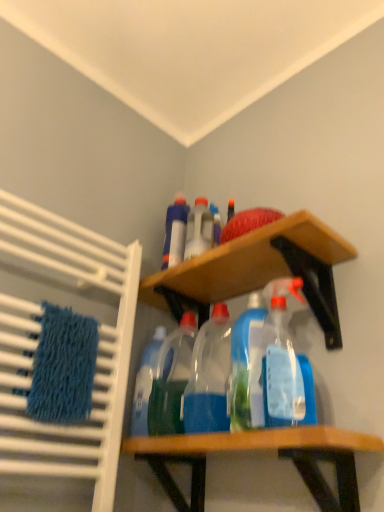
Question: Which direction should I rotate to face translucent plastic spray bottle at center, the 3th bottle when ordered from front to back, — up or down?

Choices:
 (A) up
 (B) down

Answer: (A)

Question: Can you confirm if wooden shelf at center, acting as the 2th shelf starting from the top, is thinner than translucent plastic spray bottle at center, the 3th bottle when ordered from front to back?

Choices:
 (A) yes
 (B) no

Answer: (B)

Question: Does wooden shelf at center, acting as the 2th shelf starting from the top, have a greater height compared to translucent plastic spray bottle at center, the 3th bottle when ordered from front to back?

Choices:
 (A) yes
 (B) no

Answer: (B)

Question: Does wooden shelf at center, acting as the 2th shelf starting from the top, contain translucent plastic spray bottle at center, the second bottle from the back?

Choices:
 (A) yes
 (B) no

Answer: (B)

Question: Is wooden shelf at center, acting as the 2th shelf starting from the top, closer to the viewer compared to translucent plastic spray bottle at center, the second bottle from the back?

Choices:
 (A) yes
 (B) no

Answer: (A)

Question: Is wooden shelf at center, the first shelf positioned from the bottom, to the right of translucent plastic spray bottle at center, the second bottle from the back, from the viewer's perspective?

Choices:
 (A) no
 (B) yes

Answer: (B)

Question: From a real-world perspective, is wooden shelf at center, the first shelf positioned from the bottom, under translucent plastic spray bottle at center, the 3th bottle when ordered from front to back?

Choices:
 (A) no
 (B) yes

Answer: (B)

Question: From the image's perspective, does translucent plastic bottle at center, the 2th bottle when ordered from front to back, appear lower than blue textured bath towel at left?

Choices:
 (A) no
 (B) yes

Answer: (B)

Question: Is translucent plastic bottle at center, the 2th bottle when ordered from front to back, to the left of blue textured bath towel at left from the viewer's perspective?

Choices:
 (A) yes
 (B) no

Answer: (B)

Question: Is translucent plastic bottle at center, the 2th bottle when ordered from front to back, shorter than blue textured bath towel at left?

Choices:
 (A) yes
 (B) no

Answer: (B)

Question: Is translucent plastic bottle at center, the 2th bottle when ordered from front to back, turned away from blue textured bath towel at left?

Choices:
 (A) no
 (B) yes

Answer: (A)

Question: Are translucent plastic bottle at center, the 2th bottle when ordered from front to back, and blue textured bath towel at left far apart?

Choices:
 (A) yes
 (B) no

Answer: (B)

Question: Does translucent plastic bottle at center, positioned as the third bottle in back-to-front order, have a smaller size compared to blue textured bath towel at left?

Choices:
 (A) yes
 (B) no

Answer: (A)

Question: Does wooden shelf at upper center, the second shelf from the bottom, have a smaller size compared to translucent plastic spray bottle at center, placed as the second cleaning product when sorted from right to left?

Choices:
 (A) no
 (B) yes

Answer: (A)